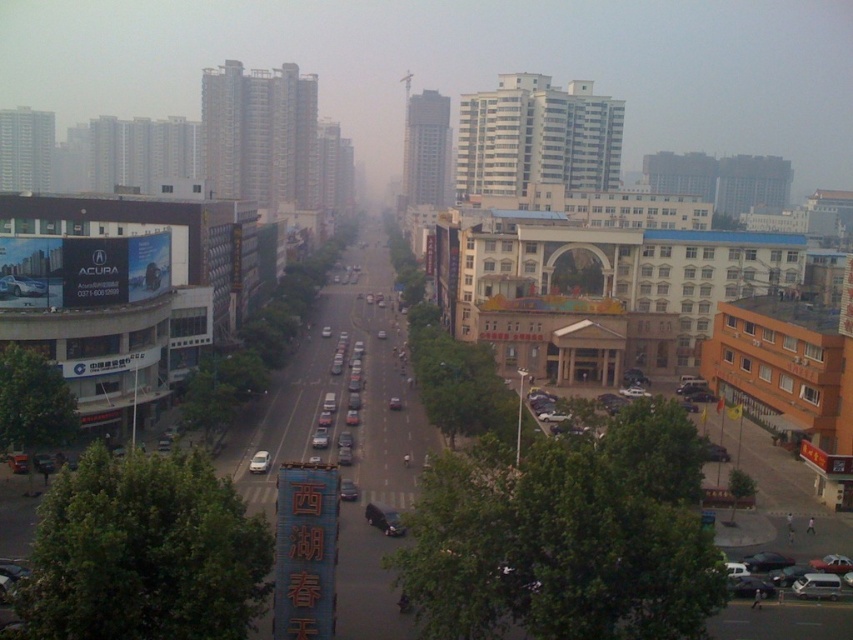
Who is positioned more to the right, silver metallic sedan at lower right or matte black car at left?

silver metallic sedan at lower right

Is the position of silver metallic sedan at lower right less distant than that of matte black car at left?

Yes, silver metallic sedan at lower right is closer to the viewer.

Between point (752, 595) and point (0, 288), which one is positioned in front?

Point (752, 595) is in front.

This screenshot has height=640, width=853. I want to click on silver metallic sedan at lower right, so click(782, 580).

Does silver metallic sedan at lower right appear under shiny black car at center?

Yes.

The width and height of the screenshot is (853, 640). I want to click on silver metallic sedan at lower right, so click(782, 580).

Between point (759, 589) and point (387, 531), which one is positioned behind?

The point (387, 531) is behind.

Where is `silver metallic sedan at lower right`? This screenshot has width=853, height=640. silver metallic sedan at lower right is located at coordinates (782, 580).

Based on the photo, is satin silver sedan at center wider than matte black car at center?

In fact, satin silver sedan at center might be narrower than matte black car at center.

Which is below, satin silver sedan at center or matte black car at center?

Positioned lower is satin silver sedan at center.

Is point (264, 465) positioned in front of point (341, 484)?

No, (264, 465) is behind (341, 484).

The height and width of the screenshot is (640, 853). In order to click on satin silver sedan at center in this screenshot , I will do `click(259, 461)`.